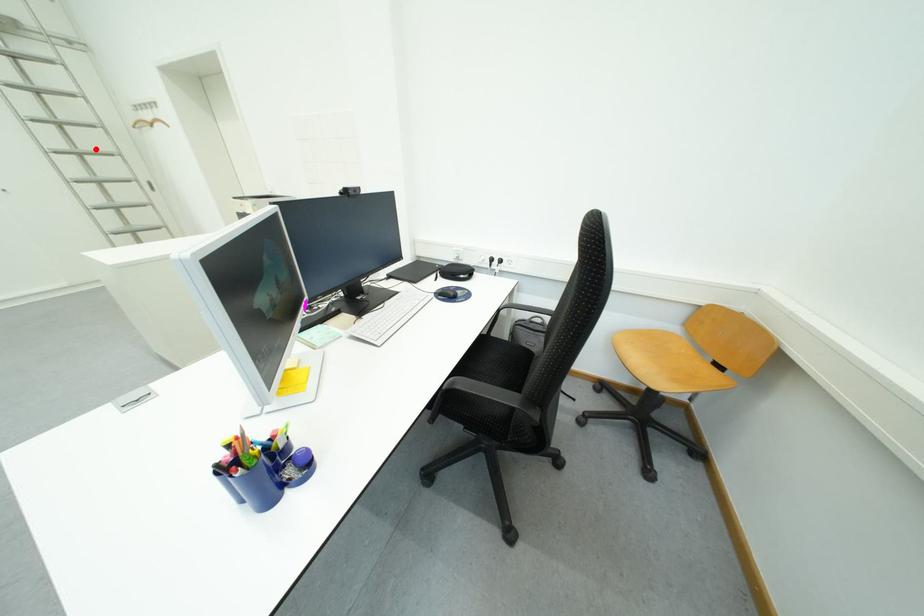
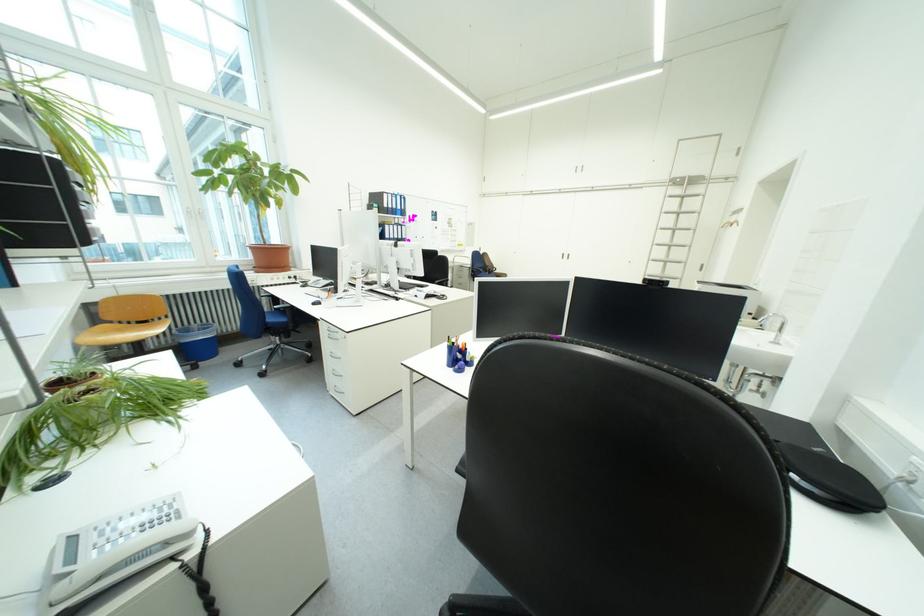
Where in the second image is the point corresponding to the highlighted location from the first image?

(687, 244)